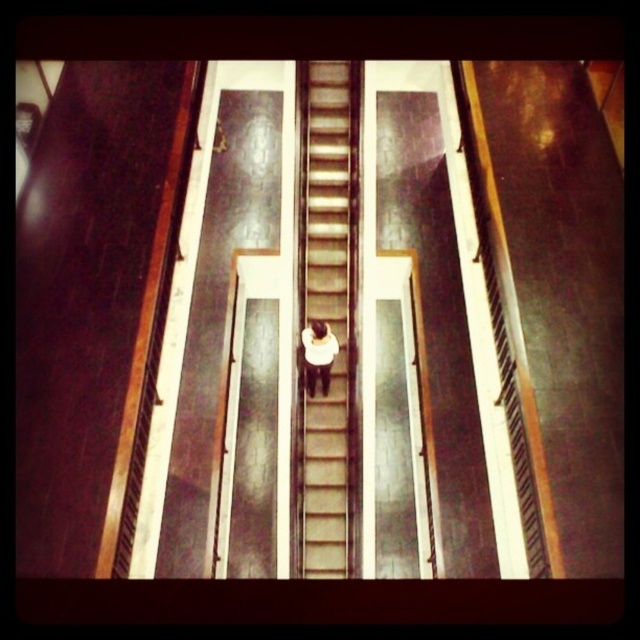
Who is taller, smooth concrete stairs at center or white matte shirt at center?

Standing taller between the two is smooth concrete stairs at center.

Does smooth concrete stairs at center come behind white matte shirt at center?

No, smooth concrete stairs at center is in front of white matte shirt at center.

Locate an element on the screen. The height and width of the screenshot is (640, 640). smooth concrete stairs at center is located at coordinates (326, 314).